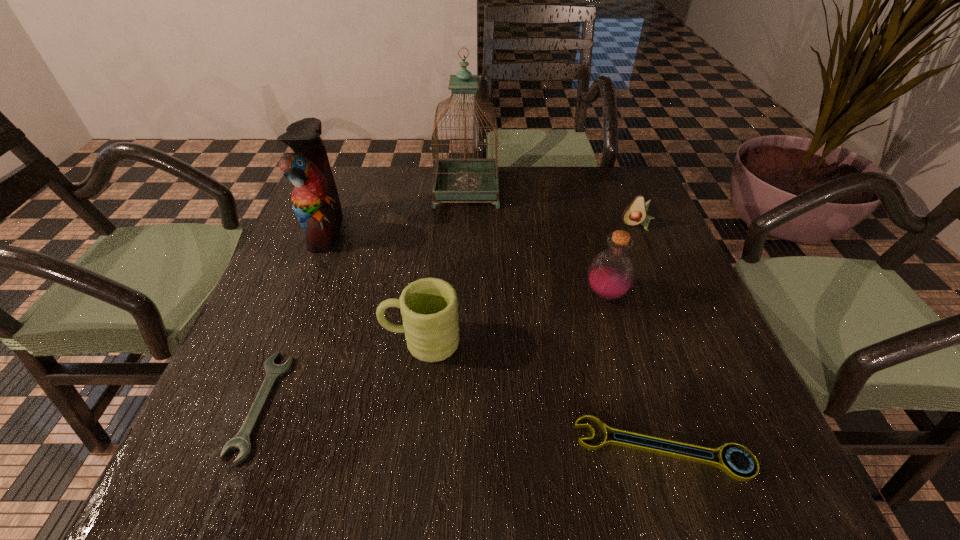
This screenshot has width=960, height=540. I want to click on wrench located at the left edge, so click(x=241, y=441).

You are a GUI agent. You are given a task and a screenshot of the screen. Output one action in this format:
    pyautogui.click(x=<x>, y=<y>)
    Task: Click on the bottle that is at the right edge
    This screenshot has width=960, height=540.
    Given the screenshot: What is the action you would take?
    (x=611, y=273)

I want to click on avocado positioned at the right edge, so click(635, 213).

Identify the location of wrench situated at the right edge. (724, 464).

Find the location of a particular element. object that is positioned at the far left corner is located at coordinates (315, 200).

Where is `object that is at the near left corner`? The image size is (960, 540). object that is at the near left corner is located at coordinates (241, 441).

Identify the location of object located in the near right corner section of the desktop. (724, 464).

In the image, there is a desktop. Where is `vacant space at the far edge`? The height and width of the screenshot is (540, 960). vacant space at the far edge is located at coordinates (526, 201).

The image size is (960, 540). In order to click on free location at the near edge in this screenshot , I will do `click(311, 448)`.

Where is `free space at the left edge of the desktop`? The image size is (960, 540). free space at the left edge of the desktop is located at coordinates (222, 394).